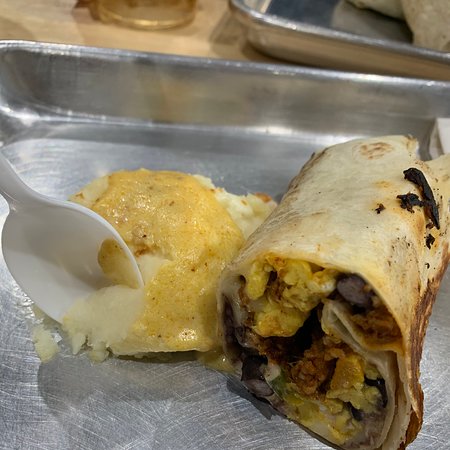
Locate an element on the screen. This screenshot has height=450, width=450. handle is located at coordinates (11, 185).